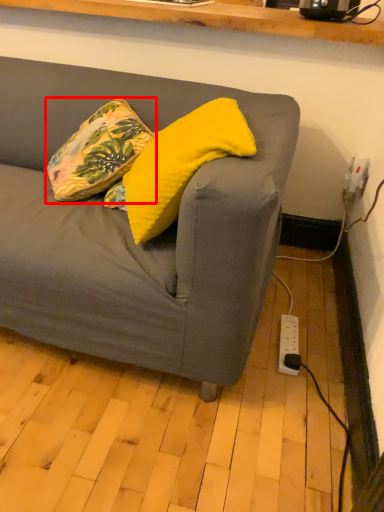
Question: From the image's perspective, what is the correct spatial positioning of pillow (annotated by the red box) in reference to pillow?

Choices:
 (A) above
 (B) below

Answer: (A)